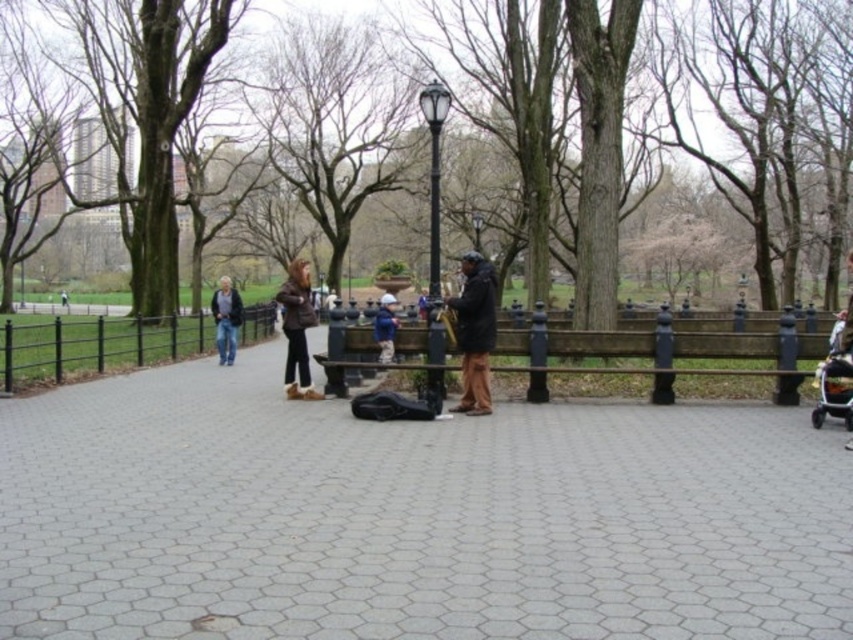
You are a city planner reviewing the park layout. You need to determine which area takes up more space in the image between the gray concrete pavement at center and the black metal fence at left. Which one is larger?

The black metal fence at left occupies more space in the image than the gray concrete pavement at center because the description states that the gray concrete pavement at center occupies less space than the black metal fence at left.